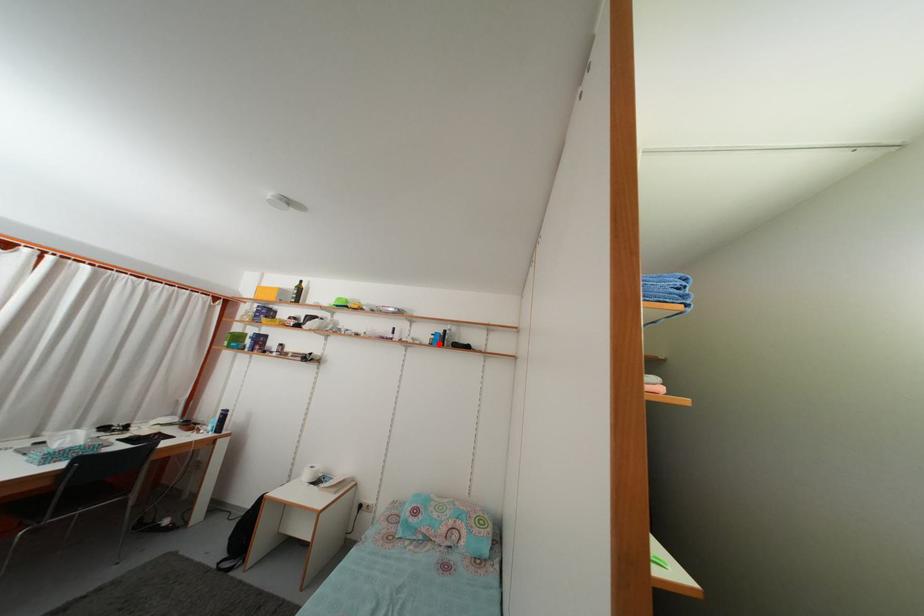
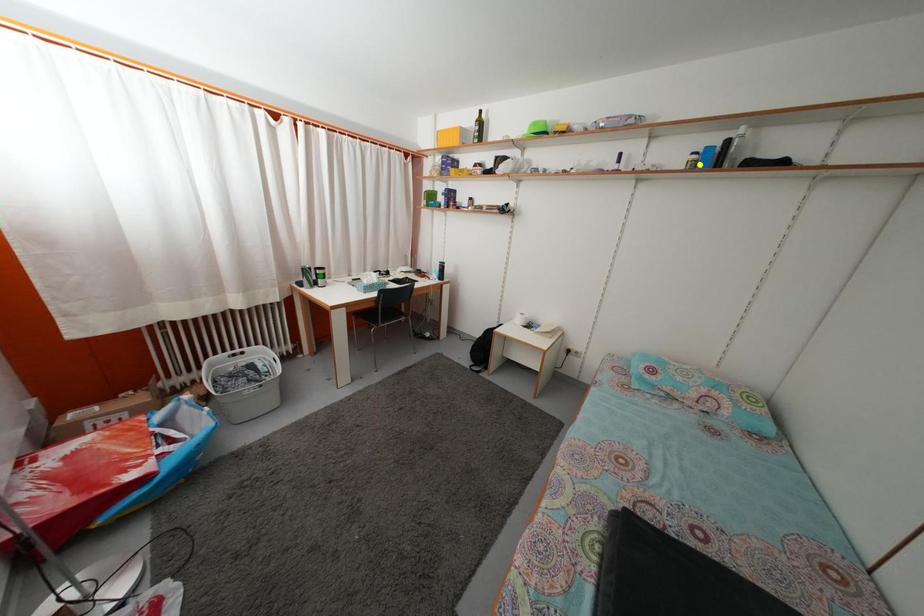
Question: I am providing you with two images of the same scene from different viewpoints. A red point is marked on the first image. You are given multiple points on the second image. In image 2, which mark is for the same physical point as the one in image 1?

Choices:
 (A) blue point
 (B) yellow point
 (C) green point

Answer: (B)